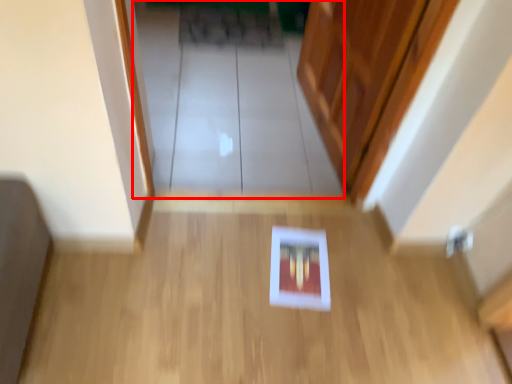
Question: Observing the image, what is the correct spatial positioning of glass door (annotated by the red box) in reference to corridor?

Choices:
 (A) right
 (B) left

Answer: (B)